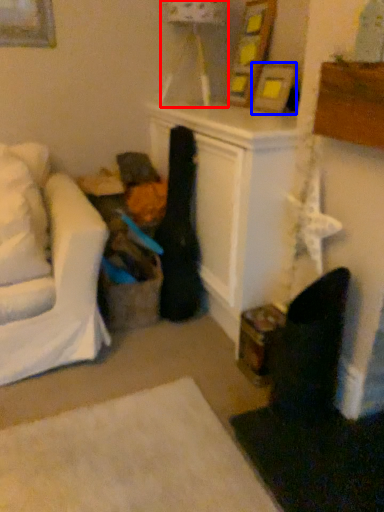
Question: Which object is closer to the camera taking this photo, lamp (highlighted by a red box) or picture frame (highlighted by a blue box)?

Choices:
 (A) lamp
 (B) picture frame

Answer: (B)